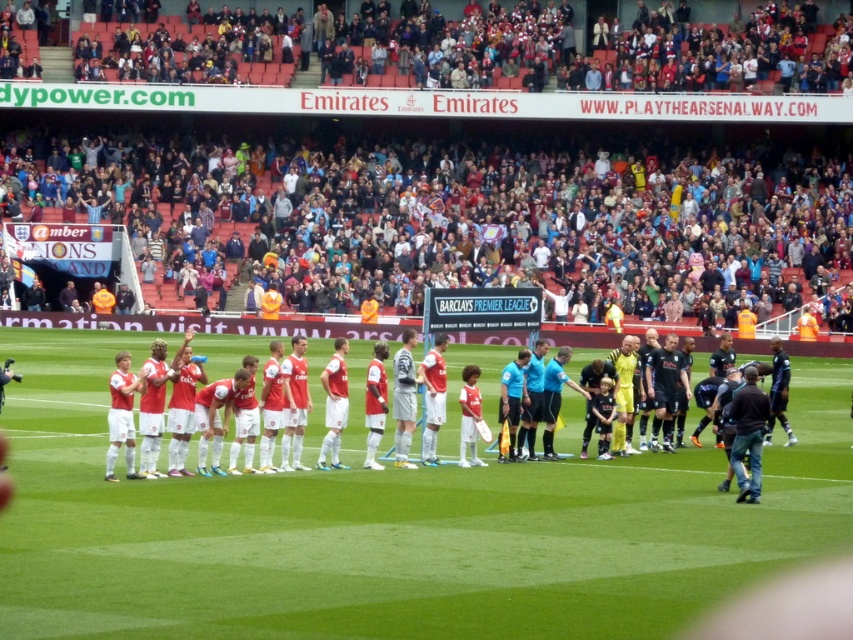
Question: Does green grass field at center have a smaller size compared to matte red jersey at center?

Choices:
 (A) no
 (B) yes

Answer: (A)

Question: Does green grass field at center appear under matte red jersey at center?

Choices:
 (A) no
 (B) yes

Answer: (B)

Question: Which of the following is the farthest from the observer?

Choices:
 (A) green grass field at center
 (B) matte red jersey at center

Answer: (B)

Question: Is green grass field at center above matte red jersey at center?

Choices:
 (A) yes
 (B) no

Answer: (B)